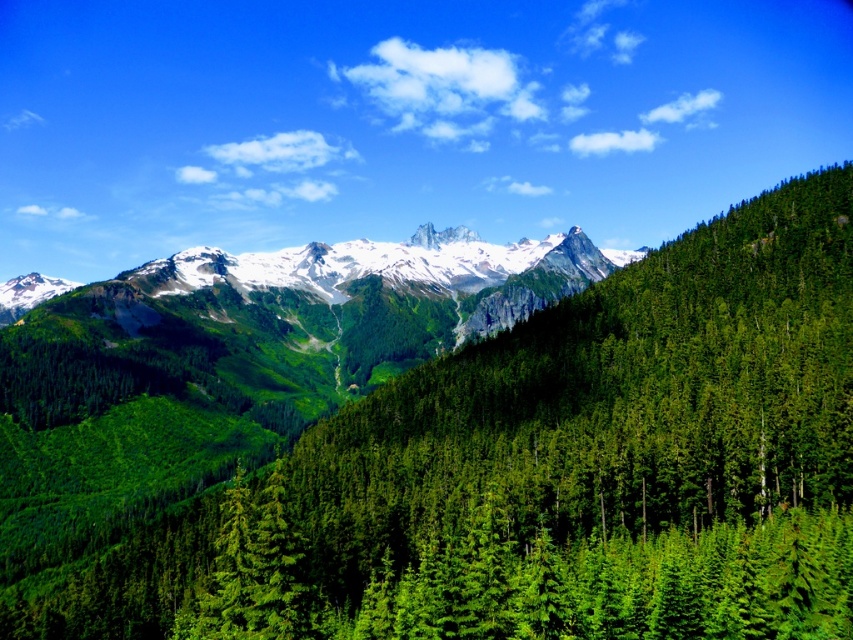
You are standing in the lush forest looking at the landscape. There are two points marked in the image, one at coordinates point (177, 376) and another at point (497, 259). Which point is closer to you?

Point (177, 376) is in front of point (497, 259), so it is closer to you.

You are standing in the lush evergreen forest in the foreground and want to reach the green forested mountain at center. According to the coordinates provided, in which direction should you head to reach it?

The green forested mountain at center is located at point (439, 444), which means you should head towards the center of the image to reach it.